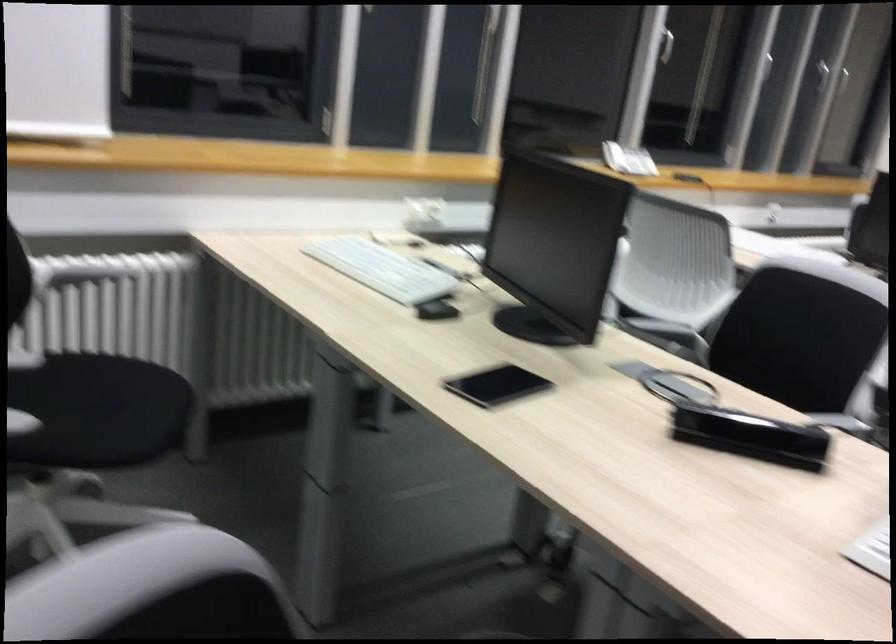
The image size is (896, 644). What do you see at coordinates (614, 156) in the screenshot?
I see `the white phone handset` at bounding box center [614, 156].